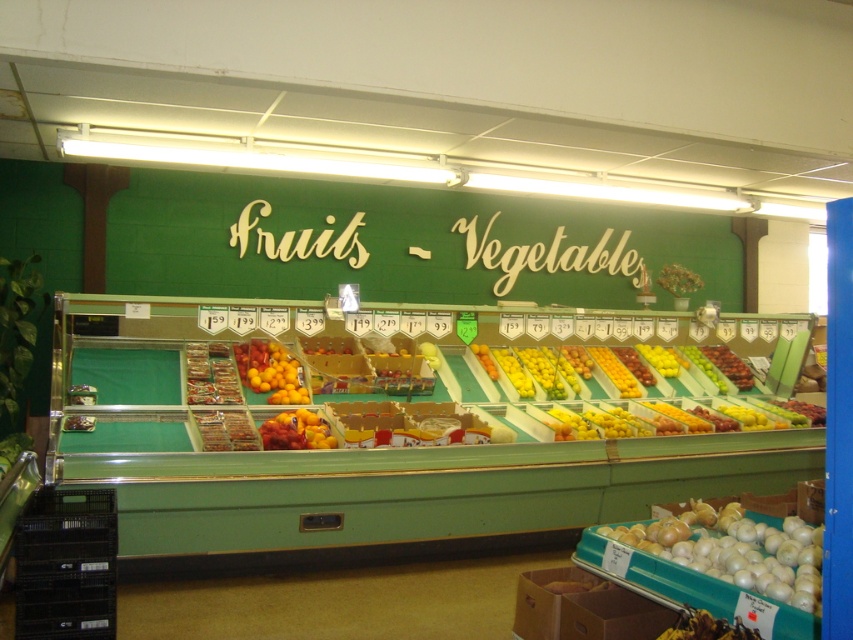
Question: Which object is the closest to the shiny red grapes at center?

Choices:
 (A) shiny red apples at center
 (B) white glossy onion at lower right
 (C) shiny yellow-orange citrus at center

Answer: (A)

Question: Can you confirm if shiny red grapes at center is wider than yellow matte lemon at center?

Choices:
 (A) yes
 (B) no

Answer: (A)

Question: Which point is closer to the camera?

Choices:
 (A) white glossy onion at lower right
 (B) shiny red grapes at center
 (C) shiny yellow citrus at center

Answer: (A)

Question: Can you confirm if shiny red grapes at center is thinner than yellow matte lemon at center?

Choices:
 (A) yes
 (B) no

Answer: (B)

Question: Which point is farther to the camera?

Choices:
 (A) pos(675,355)
 (B) pos(722,355)
 (C) pos(610,372)
 (D) pos(274,445)

Answer: (B)

Question: Is shiny yellow-orange citrus at center to the left of shiny yellow citrus at center from the viewer's perspective?

Choices:
 (A) no
 (B) yes

Answer: (B)